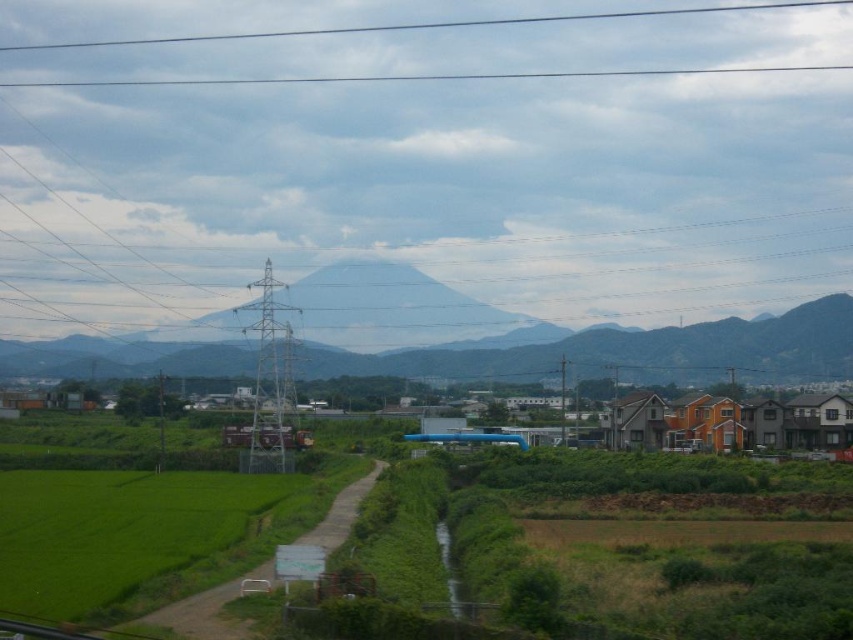
Does green grass field at lower left have a lesser width compared to gray rocky mountain at center?

Yes.

Describe the element at coordinates (134, 536) in the screenshot. The image size is (853, 640). I see `green grass field at lower left` at that location.

Who is more distant from viewer, [270,554] or [653,349]?

The point [653,349] is more distant.

Image resolution: width=853 pixels, height=640 pixels. Find the location of `green grass field at lower left`. green grass field at lower left is located at coordinates (134, 536).

Can you confirm if green grass field at lower left is positioned to the right of transparent glass power line at upper center?

No, green grass field at lower left is not to the right of transparent glass power line at upper center.

The height and width of the screenshot is (640, 853). What do you see at coordinates (134, 536) in the screenshot?
I see `green grass field at lower left` at bounding box center [134, 536].

What do you see at coordinates (134, 536) in the screenshot? The width and height of the screenshot is (853, 640). I see `green grass field at lower left` at bounding box center [134, 536].

Where is `green grass field at lower left`? The width and height of the screenshot is (853, 640). green grass field at lower left is located at coordinates (134, 536).

Can you confirm if gray rocky mountain at center is wider than transparent glass power line at upper center?

No.

Between gray rocky mountain at center and transparent glass power line at upper center, which one is positioned higher?

transparent glass power line at upper center is above.

Is point (682, 364) closer to viewer compared to point (503, 19)?

Yes, it is.

Locate an element on the screen. The height and width of the screenshot is (640, 853). gray rocky mountain at center is located at coordinates (631, 353).